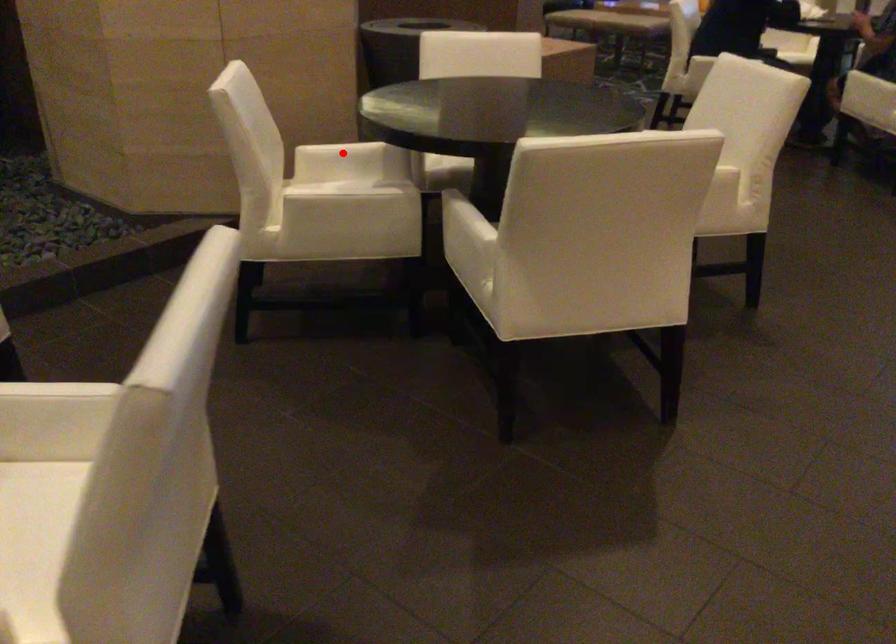
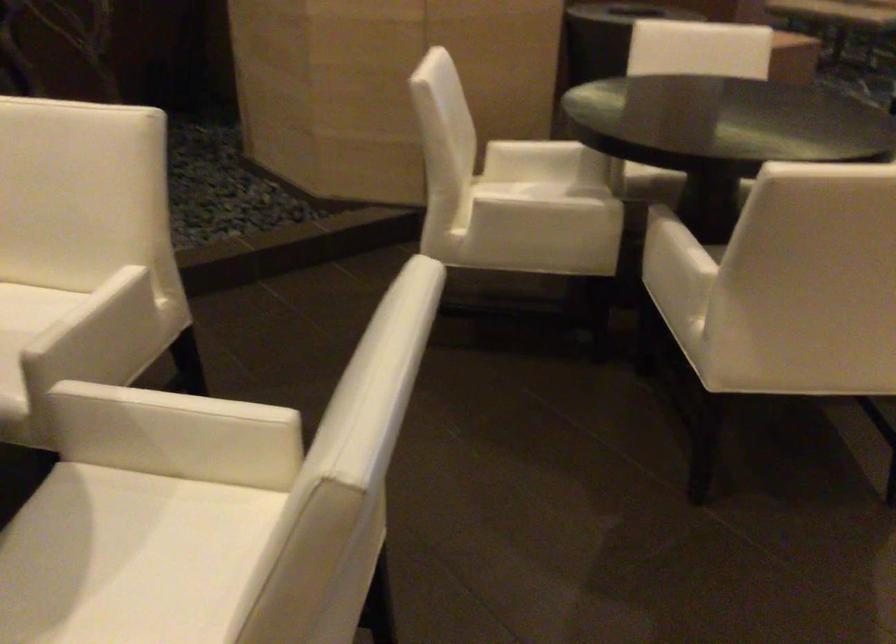
The point at the highlighted location is marked in the first image. Where is the corresponding point in the second image?

(543, 152)